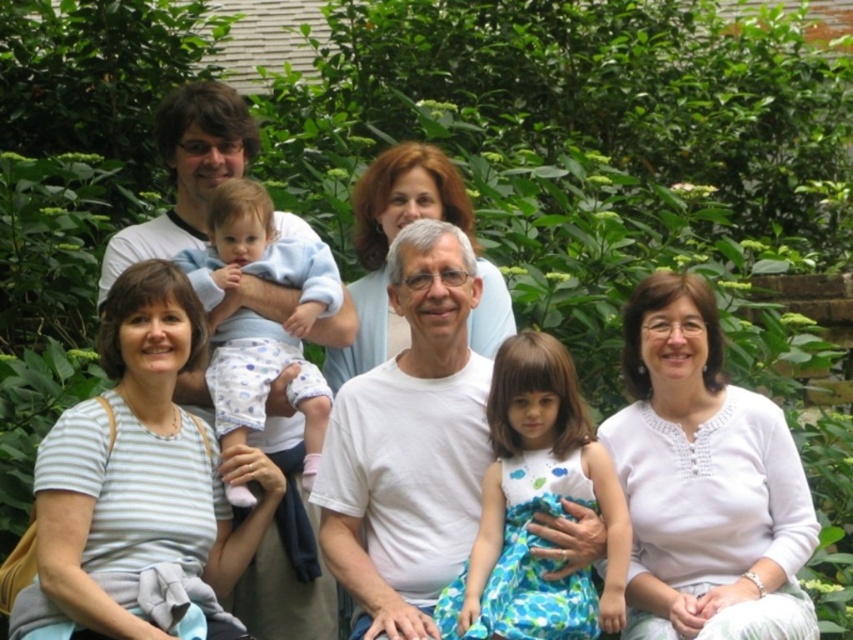
What do you see at coordinates (705, 481) in the screenshot? I see `white textured blouse at center` at bounding box center [705, 481].

Does white textured blouse at center have a greater height compared to smooth white blouse at center?

Correct, white textured blouse at center is much taller as smooth white blouse at center.

Is point (675, 410) positioned before point (474, 342)?

Yes, it is in front of point (474, 342).

Identify the location of white textured blouse at center. (705, 481).

Which is above, white striped shirt at lower left or white textured blouse at center?

Positioned higher is white striped shirt at lower left.

Which is behind, point (120, 436) or point (730, 582)?

Positioned behind is point (730, 582).

Locate an element on the screen. The image size is (853, 640). white striped shirt at lower left is located at coordinates (137, 484).

Consider the image. Which of these two, printed cotton dress at center or smooth white blouse at center, stands shorter?

printed cotton dress at center

Which is more to the right, printed cotton dress at center or smooth white blouse at center?

printed cotton dress at center

Is point (612, 605) closer to camera compared to point (409, 193)?

That is True.

Locate an element on the screen. printed cotton dress at center is located at coordinates (537, 508).